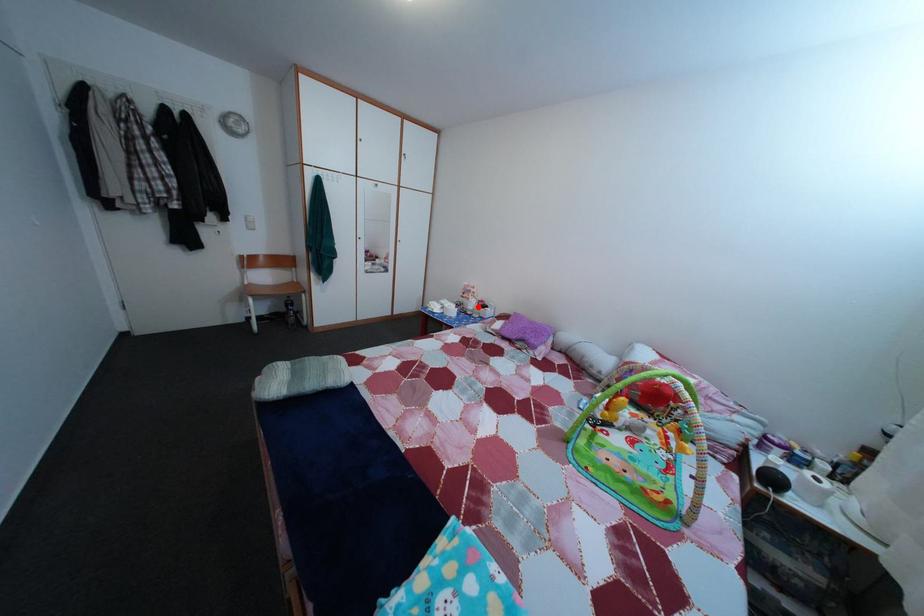
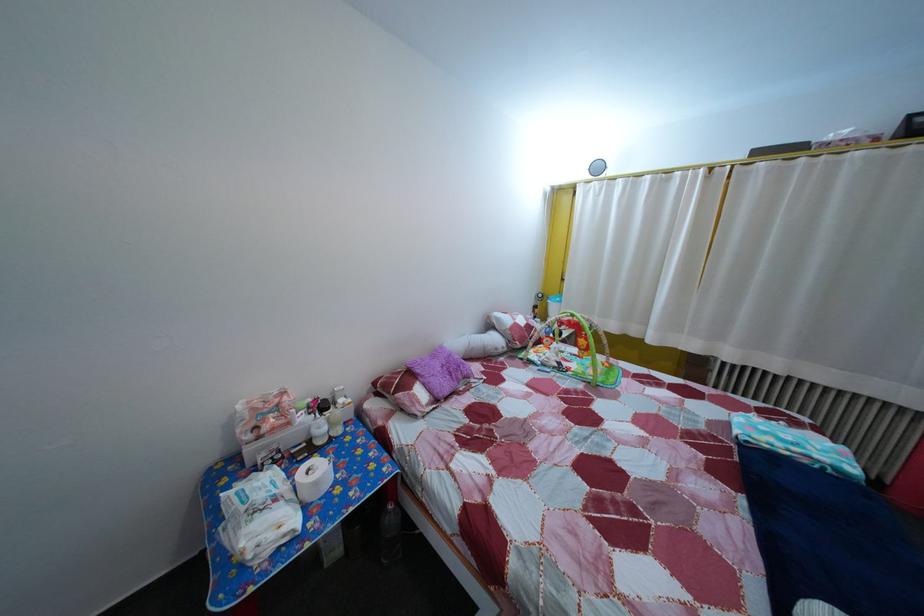
In the second image, find the point that corresponds to the highlighted location in the first image.

(298, 432)